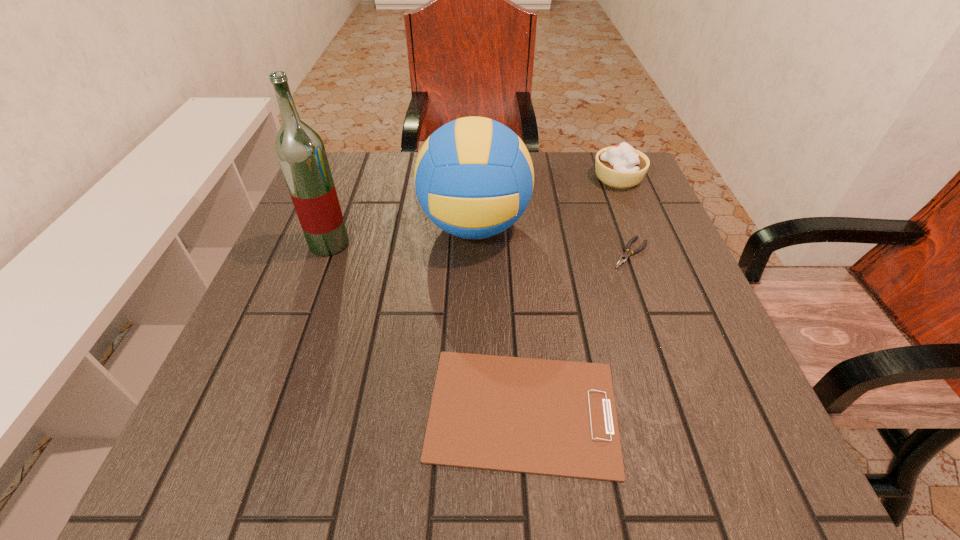
Locate an element on the screen. The image size is (960, 540). liquor is located at coordinates (300, 150).

Where is `the tallest object`? This screenshot has height=540, width=960. the tallest object is located at coordinates [x=300, y=150].

At what (x,y) coordinates should I click in order to perform the action: click on the fourth shortest object. Please return your answer as a coordinate pair (x, y). Looking at the image, I should click on (474, 177).

Locate an element on the screen. whipped cream is located at coordinates (621, 166).

This screenshot has width=960, height=540. I want to click on the third shortest object, so click(x=621, y=166).

The height and width of the screenshot is (540, 960). Identify the location of pliers. (627, 254).

I want to click on clipboard, so click(550, 417).

Where is `free space located 0.230m on the front of the liquor`? Image resolution: width=960 pixels, height=540 pixels. free space located 0.230m on the front of the liquor is located at coordinates (292, 345).

Where is `vacant space located on the right of the volleyball`? vacant space located on the right of the volleyball is located at coordinates (625, 226).

You are a GUI agent. You are given a task and a screenshot of the screen. Output one action in this format:
    pyautogui.click(x=<x>, y=<y>)
    Task: Click on the blank space located 0.200m on the front of the third shortest object
    This screenshot has height=540, width=960.
    Given the screenshot: What is the action you would take?
    coord(645,244)